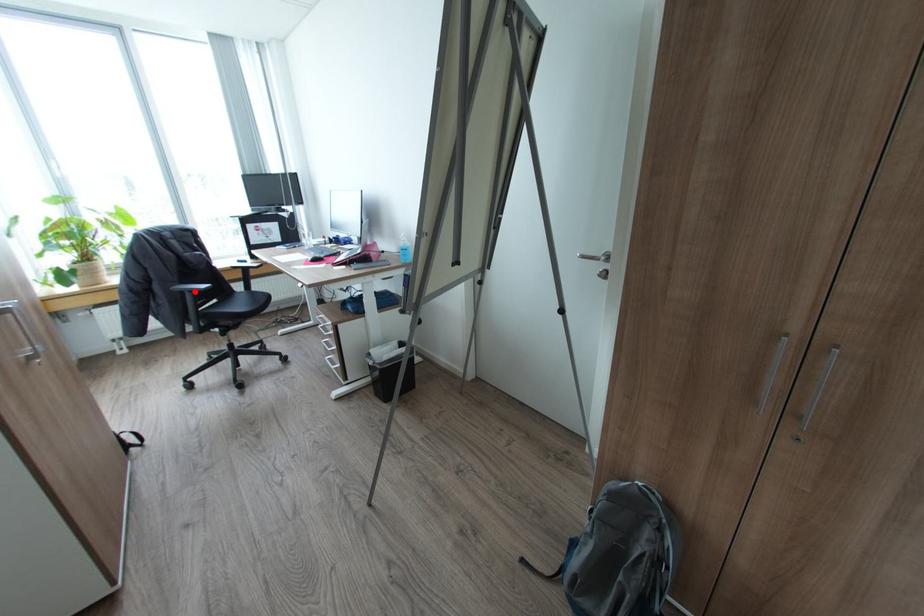
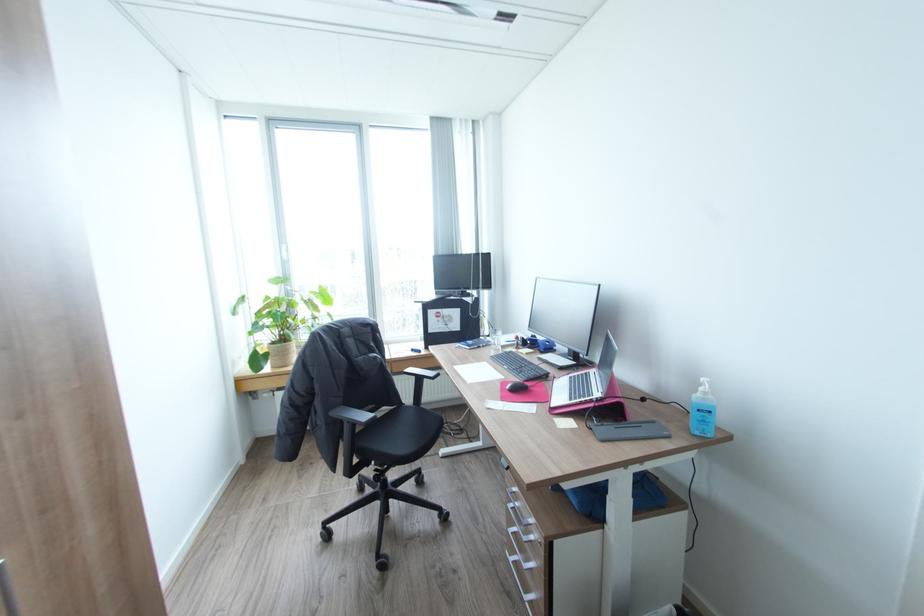
Question: I am providing you with two images of the same scene from different viewpoints. A red point is marked on the first image. Can you still see the location of the red point in image 2?

Choices:
 (A) Yes
 (B) No

Answer: (A)